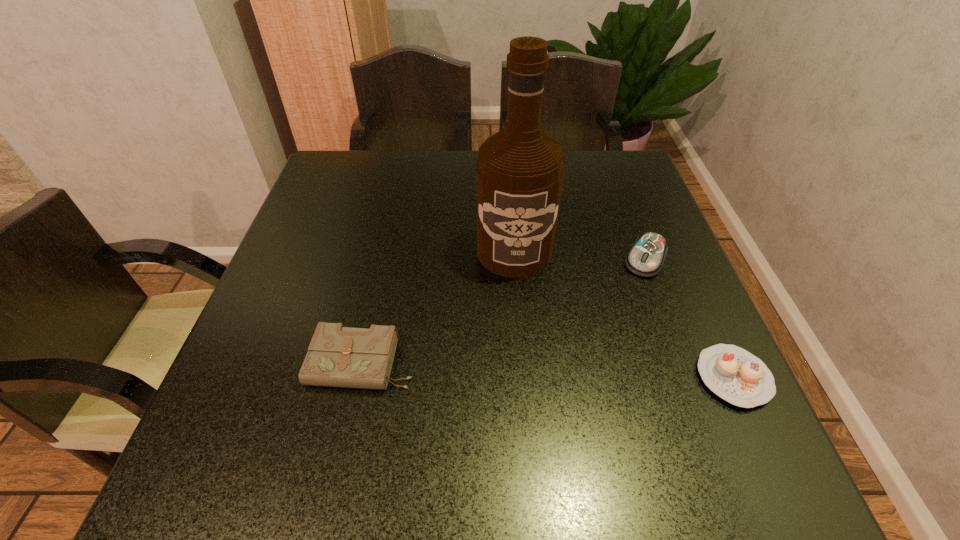
At what (x,y) coordinates should I click in order to perform the action: click on diary. Please return your answer as a coordinate pair (x, y). Looking at the image, I should click on (338, 356).

Image resolution: width=960 pixels, height=540 pixels. Identify the location of cupcake. (737, 376).

Image resolution: width=960 pixels, height=540 pixels. Find the location of `computer mouse`. computer mouse is located at coordinates (646, 257).

Find the location of a particular element. The image size is (960, 540). alcohol is located at coordinates (520, 171).

What are the coordinates of `the second object from left to right` in the screenshot? It's located at (520, 171).

This screenshot has height=540, width=960. In order to click on free region located 0.330m on the right of the diary in this screenshot , I will do `click(591, 363)`.

Where is `vacant space located on the back of the cupcake`? vacant space located on the back of the cupcake is located at coordinates (689, 279).

At what (x,y) coordinates should I click in order to perform the action: click on vacant space situated 0.400m on the wheel side of the computer mouse. Please return your answer as a coordinate pair (x, y). This screenshot has width=960, height=540. Looking at the image, I should click on (565, 420).

Where is `free space located on the wheel side of the computer mouse`? free space located on the wheel side of the computer mouse is located at coordinates (604, 346).

Identify the location of free space located on the wheel side of the computer mouse. The image size is (960, 540). (572, 407).